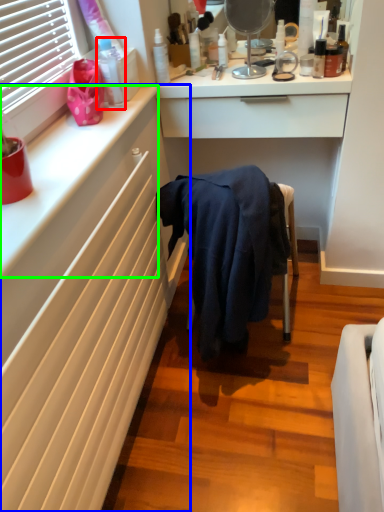
Question: Considering the real-world distances, which object is farthest from toiletry (highlighted by a red box)? cabinetry (highlighted by a blue box) or counter top (highlighted by a green box)?

Choices:
 (A) cabinetry
 (B) counter top

Answer: (A)